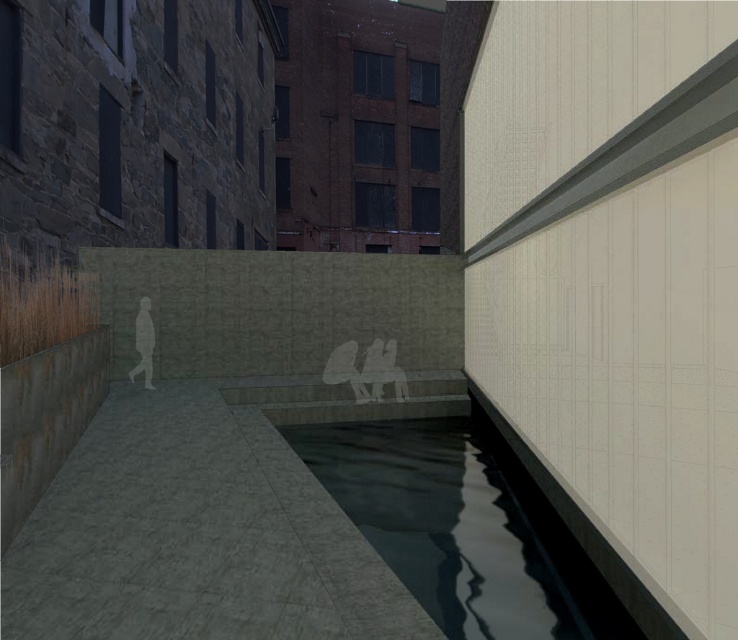
Can you confirm if dark reflective water at center is wider than silhouette figure at center?

Yes, dark reflective water at center is wider than silhouette figure at center.

Is dark reflective water at center further to the viewer compared to silhouette figure at center?

That is False.

Locate an element on the screen. Image resolution: width=738 pixels, height=640 pixels. dark reflective water at center is located at coordinates (462, 525).